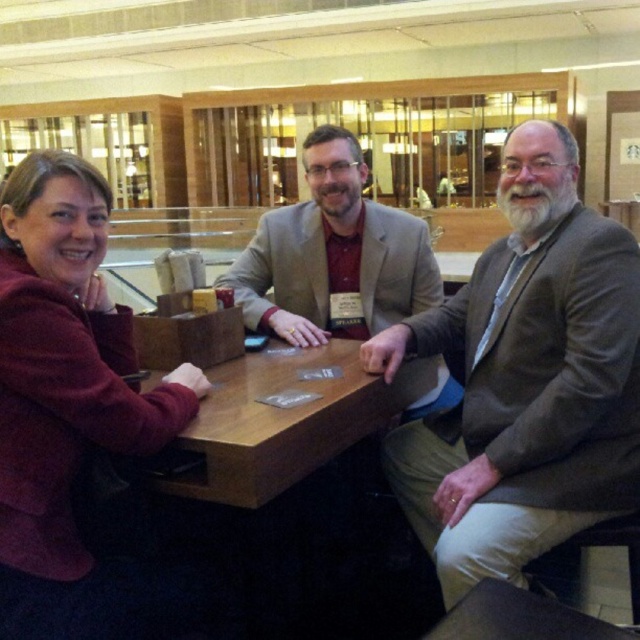
Question: Is the position of brown woolen sweater at right less distant than that of brown wooden table at center?

Choices:
 (A) yes
 (B) no

Answer: (B)

Question: Can you confirm if maroon fleece jacket at left is wider than brown wooden table at center?

Choices:
 (A) yes
 (B) no

Answer: (B)

Question: Based on their relative distances, which object is nearer to the brown woolen sweater at right?

Choices:
 (A) maroon fleece jacket at left
 (B) brown wooden table at center

Answer: (B)

Question: Which object appears closest to the camera in this image?

Choices:
 (A) brown woolen sweater at right
 (B) matte gray blazer at center
 (C) maroon fleece jacket at left
 (D) brown wooden table at center

Answer: (C)

Question: From the image, what is the correct spatial relationship of matte gray blazer at center in relation to brown wooden table at center?

Choices:
 (A) above
 (B) below

Answer: (A)

Question: Which of the following is the farthest from the observer?

Choices:
 (A) (419, 248)
 (B) (412, 374)

Answer: (A)